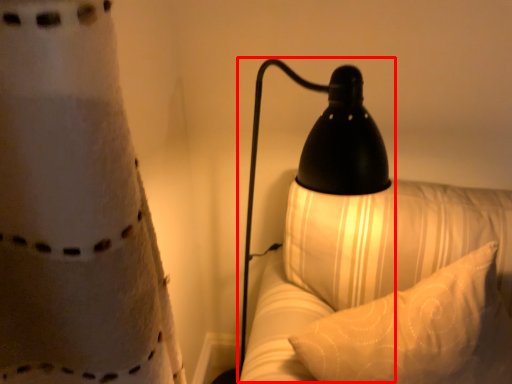
Question: From the image, what is the correct spatial relationship of lamp (annotated by the red box) in relation to pillow?

Choices:
 (A) left
 (B) right

Answer: (A)